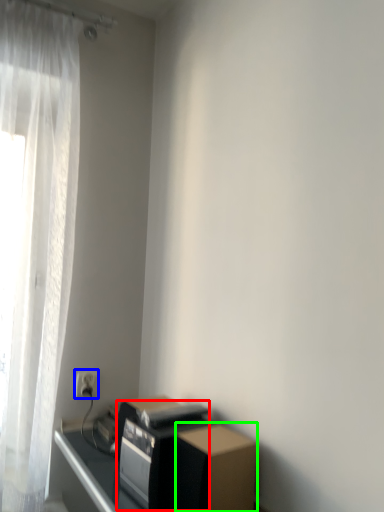
Question: Which is farther away from appliance (highlighted by a red box)? electric outlet (highlighted by a blue box) or cardboard box (highlighted by a green box)?

Choices:
 (A) electric outlet
 (B) cardboard box

Answer: (A)